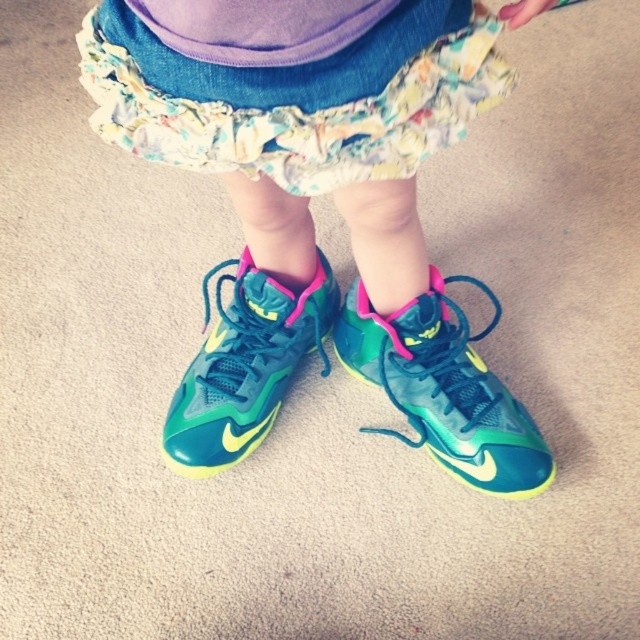
The image shows a child wearing a colorful frilly skirt with floral patterns. There is a point marked at coordinates (x=285, y=106). What is the significance of this point in relation to the child?

The point at coordinates (x=285, y=106) marks the floral cotton dress at center, indicating its central position in the image.

You are a photographer setting up a shoot for a fashion magazine. You need to ensure that the glossy synthetic shoe at center and the neon green mesh shoe at center are both visible in the final shot. Based on their current positions, which shoe should you adjust to make sure both are fully visible?

The glossy synthetic shoe at center is positioned under the neon green mesh shoe at center, so you should adjust the glossy synthetic shoe at center to move it out from under the neon green mesh shoe at center to ensure both are fully visible.